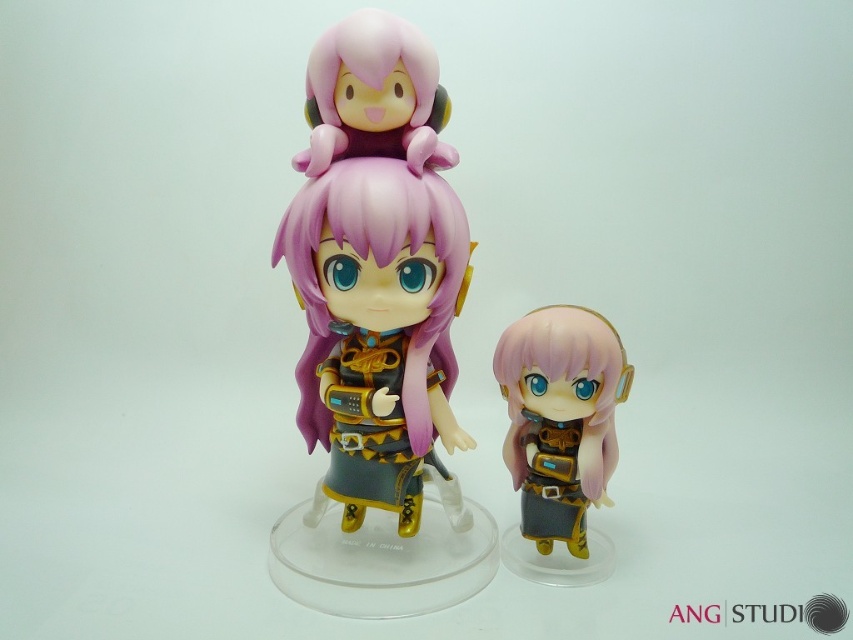
You are a collector who wants to place a new figurine between the matte black figure at center and the purple matte hair at center. The new figurine is 6 inches wide. Will it fit in the space between them?

The distance between the matte black figure at center and the purple matte hair at center is 6.69 inches, so the new figurine that is 6 inches wide will fit in the space between them.